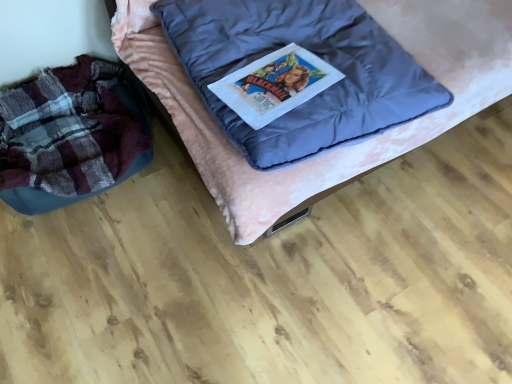
Question: Is plaid fabric bean bag at left oriented away from velvet pink bed at center?

Choices:
 (A) no
 (B) yes

Answer: (A)

Question: Does plaid fabric bean bag at left have a greater width compared to velvet pink bed at center?

Choices:
 (A) yes
 (B) no

Answer: (B)

Question: Is velvet pink bed at center surrounded by plaid fabric bean bag at left?

Choices:
 (A) no
 (B) yes

Answer: (A)

Question: Can you confirm if plaid fabric bean bag at left is bigger than velvet pink bed at center?

Choices:
 (A) yes
 (B) no

Answer: (B)

Question: Considering the relative sizes of plaid fabric bean bag at left and velvet pink bed at center in the image provided, is plaid fabric bean bag at left shorter than velvet pink bed at center?

Choices:
 (A) no
 (B) yes

Answer: (B)

Question: Can you confirm if plaid fabric bean bag at left is positioned to the left of velvet pink bed at center?

Choices:
 (A) no
 (B) yes

Answer: (B)

Question: Is velvet pink bed at center oriented towards plaid fabric bean bag at left?

Choices:
 (A) yes
 (B) no

Answer: (B)

Question: From a real-world perspective, is velvet pink bed at center physically below plaid fabric bean bag at left?

Choices:
 (A) no
 (B) yes

Answer: (A)

Question: Is velvet pink bed at center taller than plaid fabric bean bag at left?

Choices:
 (A) yes
 (B) no

Answer: (A)

Question: From the image's perspective, would you say velvet pink bed at center is shown under plaid fabric bean bag at left?

Choices:
 (A) no
 (B) yes

Answer: (A)

Question: Is velvet pink bed at center outside of plaid fabric bean bag at left?

Choices:
 (A) no
 (B) yes

Answer: (B)

Question: From the image's perspective, is velvet pink bed at center over plaid fabric bean bag at left?

Choices:
 (A) yes
 (B) no

Answer: (A)

Question: Considering the positions of plaid fabric bean bag at left and velvet pink bed at center in the image, is plaid fabric bean bag at left bigger or smaller than velvet pink bed at center?

Choices:
 (A) big
 (B) small

Answer: (B)